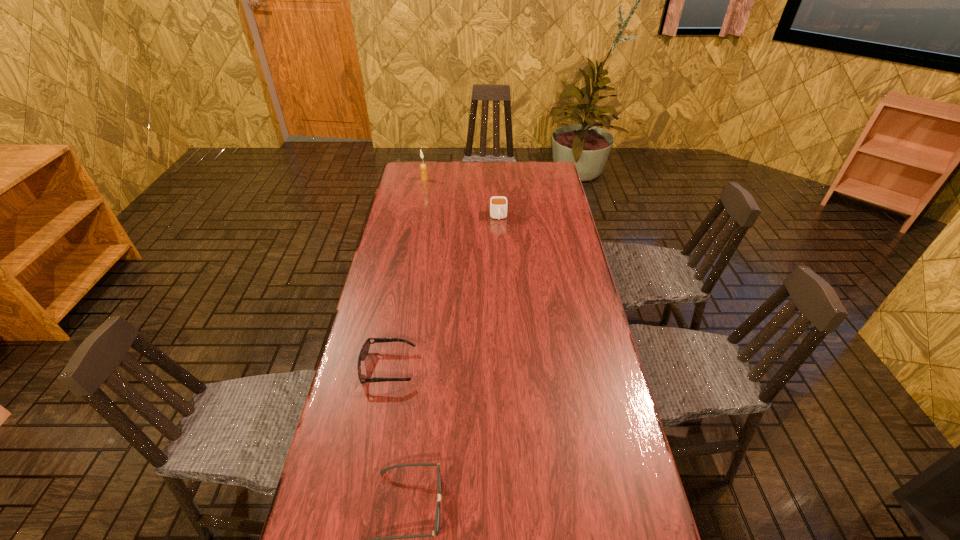
You are a GUI agent. You are given a task and a screenshot of the screen. Output one action in this format:
    pyautogui.click(x=<x>, y=<y>)
    Task: Click on the candle
    
    Given the screenshot: What is the action you would take?
    pyautogui.click(x=423, y=168)

Where is `the tallest object`? This screenshot has width=960, height=540. the tallest object is located at coordinates (423, 168).

Where is `the third nearest object`? the third nearest object is located at coordinates (498, 204).

This screenshot has height=540, width=960. Find the location of `the third shortest object`. the third shortest object is located at coordinates (498, 204).

This screenshot has width=960, height=540. In order to click on the third farthest object in this screenshot , I will do `click(364, 351)`.

Find the location of a particular element. free space located 0.360m on the front of the farthest object is located at coordinates (416, 226).

Locate an element on the screen. The image size is (960, 540). free location located 0.170m on the side with the handle of the rightmost object is located at coordinates (500, 251).

This screenshot has height=540, width=960. What are the coordinates of `vacant point located on the front-facing side of the sunglasses` in the screenshot? It's located at (467, 367).

This screenshot has height=540, width=960. I want to click on object at the far edge, so [x=423, y=168].

At what (x,y) coordinates should I click in order to perform the action: click on candle situated at the left edge. Please return your answer as a coordinate pair (x, y). The width and height of the screenshot is (960, 540). Looking at the image, I should click on (423, 168).